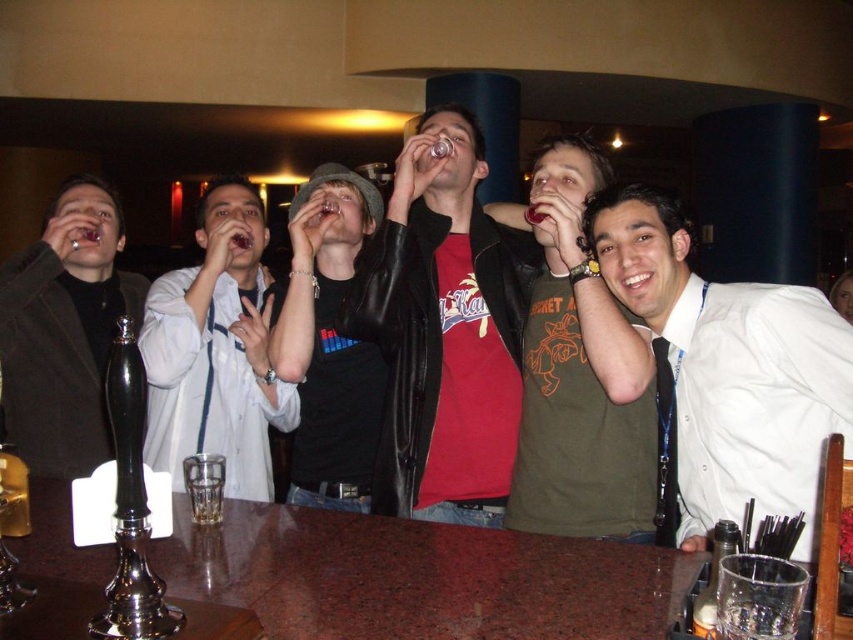
Is matte black jacket at left taller than black leather jacket at center?

No, matte black jacket at left is not taller than black leather jacket at center.

Measure the distance from matte black jacket at left to black leather jacket at center.

25.87 inches

Who is more distant from viewer, (x=18, y=321) or (x=355, y=412)?

Positioned behind is point (x=18, y=321).

In order to click on matte black jacket at left in this screenshot , I will do `click(65, 330)`.

Who is higher up, white shirt at center or green matte t-shirt at center?

green matte t-shirt at center

Can you confirm if white shirt at center is thinner than green matte t-shirt at center?

No.

Is point (846, 326) positioned after point (517, 493)?

No.

Where is `white shirt at center`? This screenshot has height=640, width=853. white shirt at center is located at coordinates (724, 371).

Which is more to the left, white shirt at center or leather jacket at center?

leather jacket at center is more to the left.

Is white shirt at center smaller than leather jacket at center?

Correct, white shirt at center occupies less space than leather jacket at center.

Which is behind, point (717, 420) or point (457, 500)?

The point (457, 500) is more distant.

Image resolution: width=853 pixels, height=640 pixels. I want to click on white shirt at center, so click(724, 371).